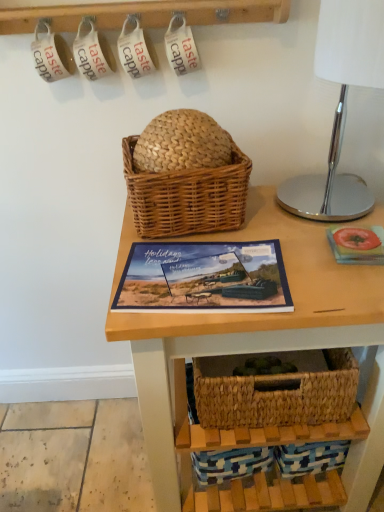
Question: Would you say woven wood table at center is inside or outside matte blue book at center?

Choices:
 (A) inside
 (B) outside

Answer: (B)

Question: From the image's perspective, is woven wood table at center located above or below matte blue book at center?

Choices:
 (A) below
 (B) above

Answer: (A)

Question: Based on their relative distances, which object is nearer to the woven wood table at center?

Choices:
 (A) woven brown picnic basket at center
 (B) matte blue book at center
 (C) polished chrome table lamp at right

Answer: (B)

Question: Estimate the real-world distances between objects in this image. Which object is farther from the matte blue book at center?

Choices:
 (A) woven brown picnic basket at center
 (B) polished chrome table lamp at right
 (C) woven wood table at center

Answer: (B)